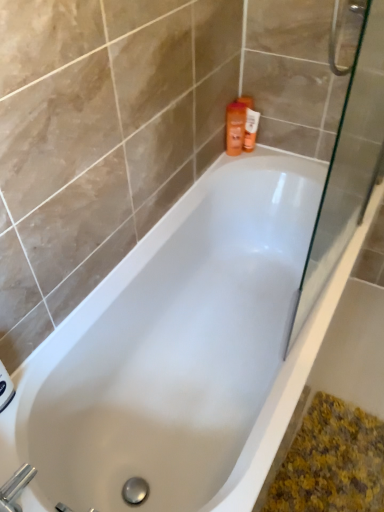
Question: Looking at their shapes, would you say orange plastic bottle at upper right is wider or thinner than transparent glass screen door at right?

Choices:
 (A) thin
 (B) wide

Answer: (B)

Question: Considering their positions, is orange plastic bottle at upper right located in front of or behind transparent glass screen door at right?

Choices:
 (A) front
 (B) behind

Answer: (B)

Question: Which object is the closest to the orange matte bottle at upper right?

Choices:
 (A) transparent glass screen door at right
 (B) white glossy bathtub at center
 (C) orange plastic bottle at upper right
 (D) silver metallic faucet at lower left

Answer: (C)

Question: Based on their relative distances, which object is farther from the orange matte bottle at upper right?

Choices:
 (A) transparent glass screen door at right
 (B) orange plastic bottle at upper right
 (C) white glossy bathtub at center
 (D) silver metallic faucet at lower left

Answer: (D)